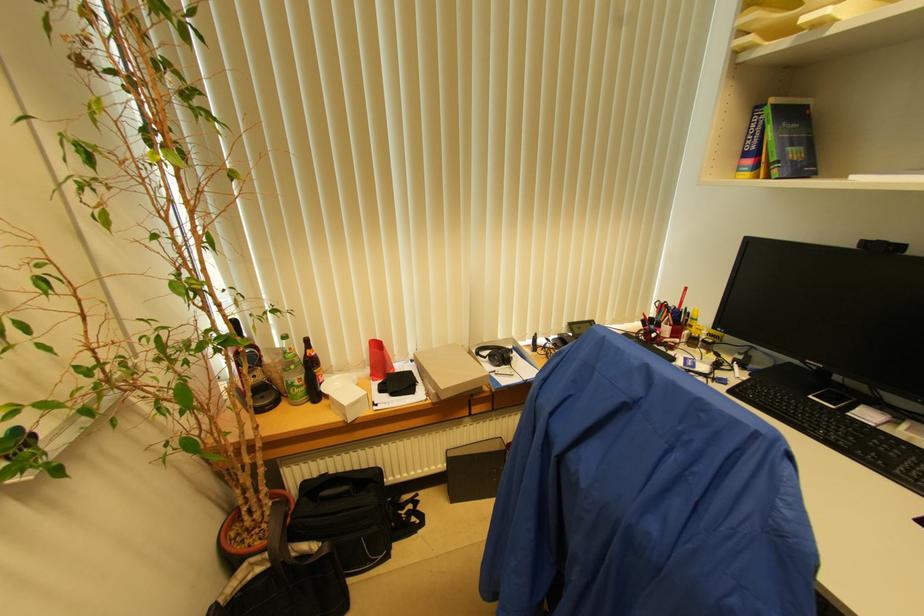
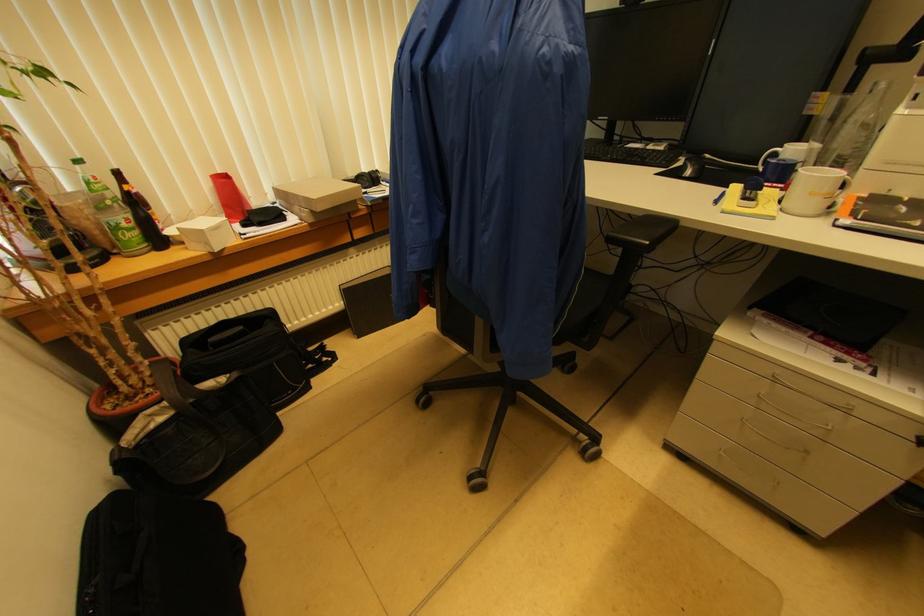
Question: Based on the continuous images, in which direction is the camera rotating? Reply with the corresponding letter.

Choices:
 (A) Left
 (B) Right
 (C) Up
 (D) Down

Answer: (B)